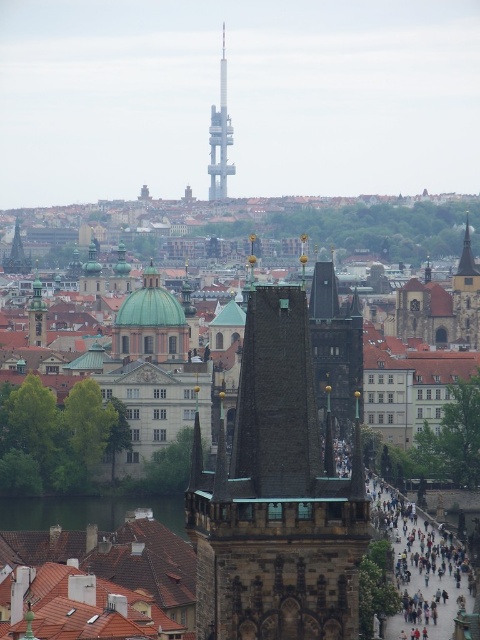
Does dark gray stone tower at center have a lesser height compared to green water at lower left?

In fact, dark gray stone tower at center may be taller than green water at lower left.

Is dark gray stone tower at center above green water at lower left?

Yes, dark gray stone tower at center is above green water at lower left.

Which is behind, point (210, 524) or point (16, 522)?

Point (16, 522)

The width and height of the screenshot is (480, 640). Identify the location of dark gray stone tower at center. (276, 497).

At what (x,y) coordinates should I click in order to perform the action: click on dark gray stone bridge at lower right. Please return your answer as a coordinate pair (x, y). The height and width of the screenshot is (640, 480). Looking at the image, I should click on (422, 570).

Which is above, dark gray stone bridge at lower right or green water at lower left?

dark gray stone bridge at lower right is higher up.

Locate an element on the screen. dark gray stone bridge at lower right is located at coordinates (422, 570).

Can you confirm if dark gray stone tower at center is taller than dark gray stone bridge at lower right?

Indeed, dark gray stone tower at center has a greater height compared to dark gray stone bridge at lower right.

Which is above, dark gray stone tower at center or dark gray stone bridge at lower right?

dark gray stone tower at center is above.

Image resolution: width=480 pixels, height=640 pixels. What do you see at coordinates (276, 497) in the screenshot?
I see `dark gray stone tower at center` at bounding box center [276, 497].

Find the location of `dark gray stone tower at center`. dark gray stone tower at center is located at coordinates (276, 497).